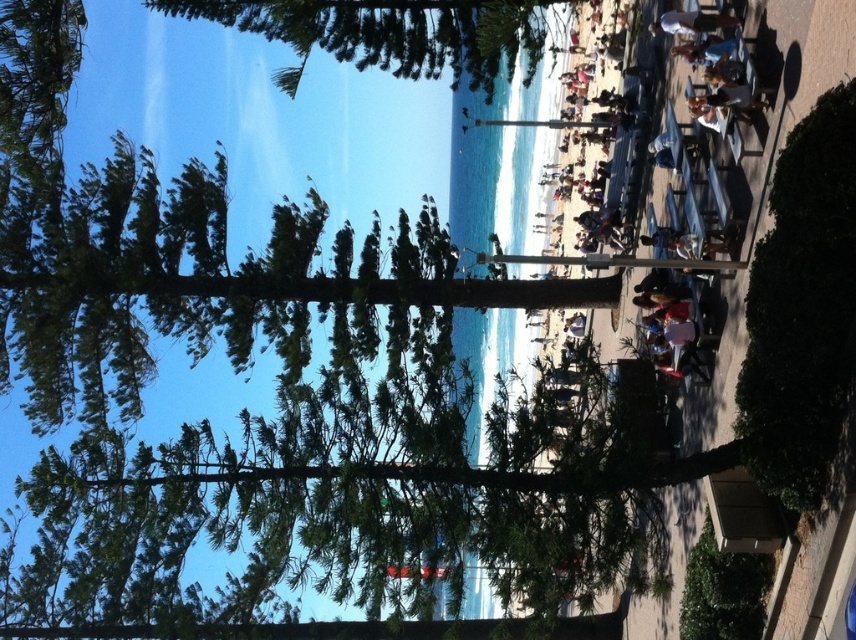
You are a photographer trying to capture a shot of the beach through the pine trees. You notice the green leafy tree at upper center and the white fabric shirt at upper right in your viewfinder. Which object will appear larger in your photo?

The green leafy tree at upper center will appear larger in the photo because it is taller than the white fabric shirt at upper right.

You are a photographer standing at the beach scene. You notice a green leafy bush at lower right and a white fabric shirt at upper right. Which object is taller in the image?

The green leafy bush at lower right is taller than the white fabric shirt at upper right.

You are standing at the beach and see the green leafy tree at upper center and the white fabric shirt at upper right. Which object is located to the left when viewed from your perspective?

The green leafy tree at upper center is positioned on the left side of the white fabric shirt at upper right, so it is located to the left.